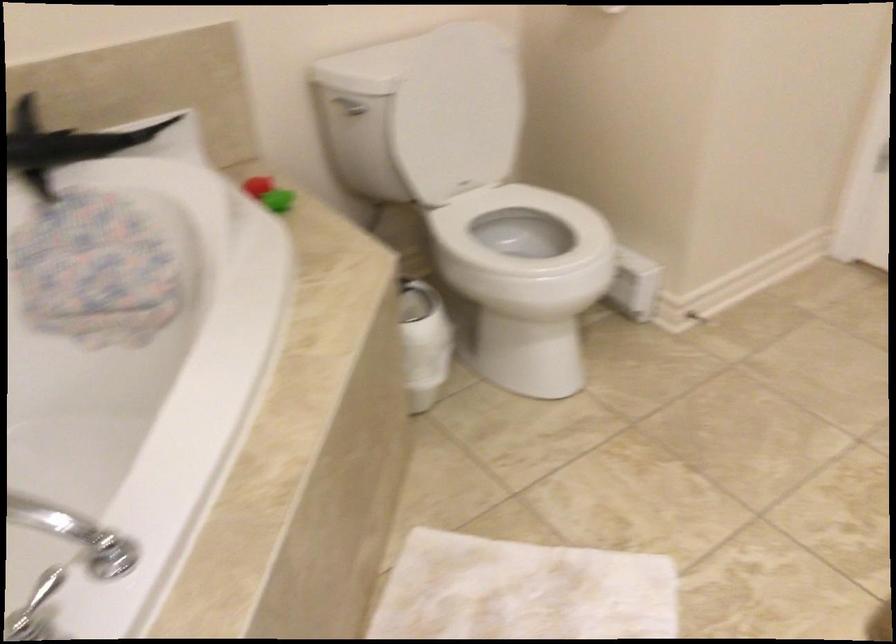
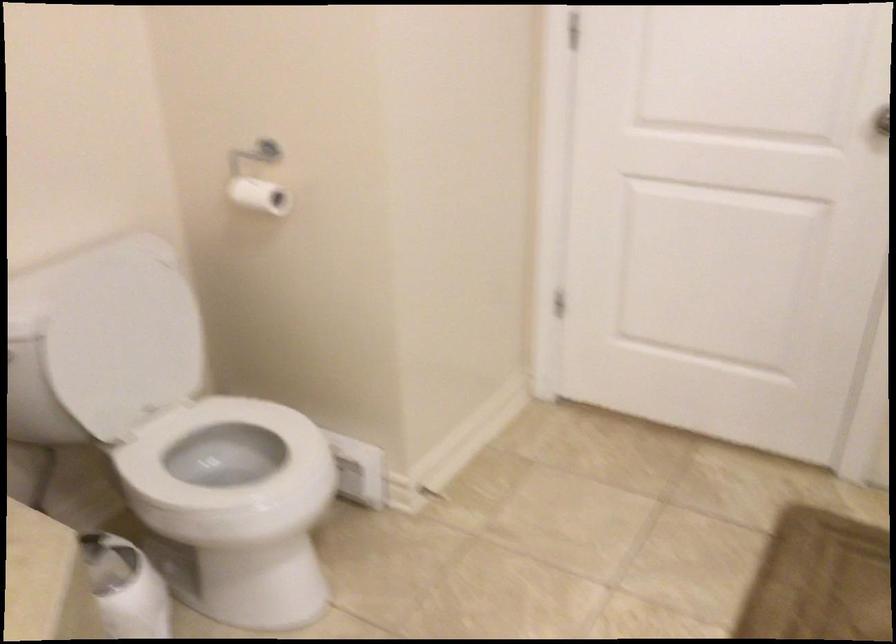
Where in the second image is the point corresponding to the point at 515,240 from the first image?

(226, 453)